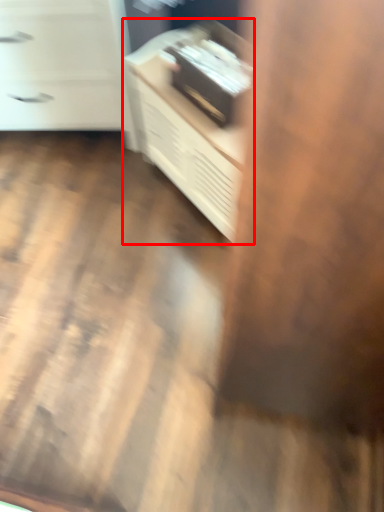
Question: From the image, what is the correct spatial relationship of furniture (annotated by the red box) in relation to chest of drawers?

Choices:
 (A) left
 (B) right

Answer: (B)